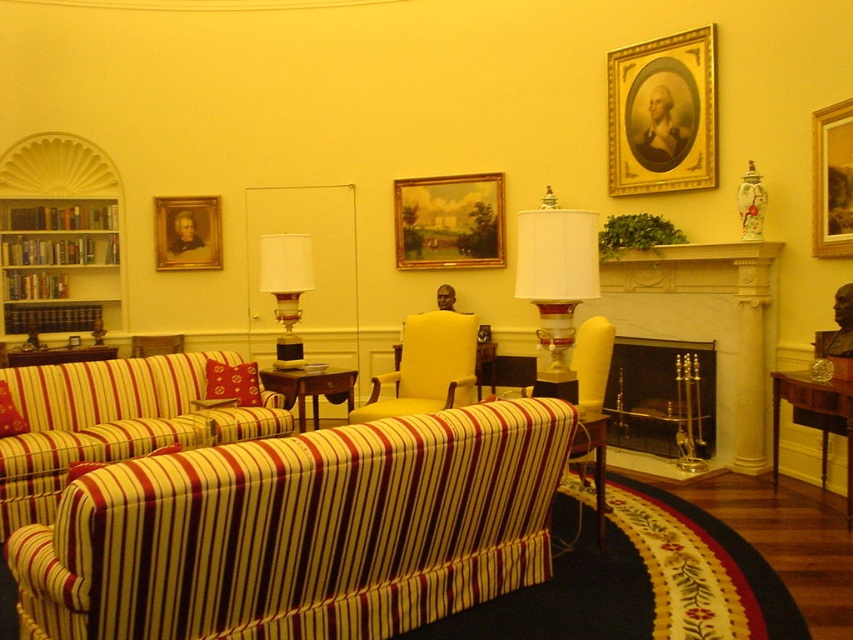
You are a guest in this room and want to sit in the matte yellow armchair at center. To do so, you must first pass by the matte glass lamp at center. Which direction should you move relative to the lamp to reach the armchair?

The matte yellow armchair at center is positioned on the right side of the matte glass lamp at center, so you should move to the right of the matte glass lamp at center to reach it.

You are a delivery person carrying a large package that measures 3 meters in length. You need to navigate through the space between the striped fabric couch at left and the black glass fireplace at center. Can you pass through this space without tilting the package?

The distance between the striped fabric couch at left and the black glass fireplace at center is 2.78 meters. Since the package is 3 meters long, it is longer than the available space. Therefore, you cannot pass through without tilting or repositioning the package.

You are standing in the room and want to place a small decorative item on the closest object between the yellow striped fabric couch at lower left and the white fabric lampshade at center. Which object should you choose?

The yellow striped fabric couch at lower left is closer to the viewer than the white fabric lampshade at center, so you should place the decorative item on the yellow striped fabric couch at lower left.